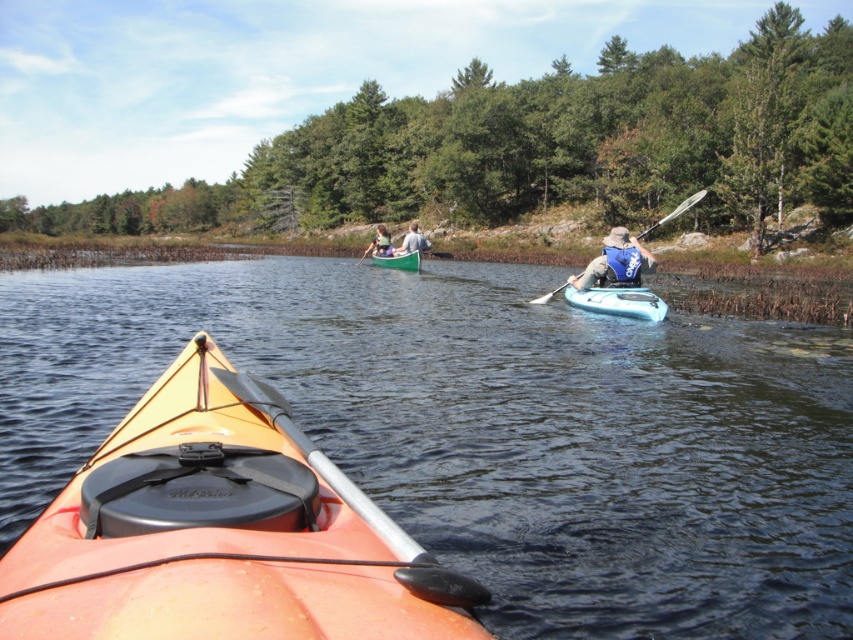
Is point (596, 285) in front of point (415, 221)?

Yes, point (596, 285) is closer to viewer.

Is point (659, 305) positioned after point (415, 244)?

No, it is not.

You are a GUI agent. You are given a task and a screenshot of the screen. Output one action in this format:
    pyautogui.click(x=<x>, y=<y>)
    Task: Click on the blue glossy kayak at center
    The width and height of the screenshot is (853, 640).
    Given the screenshot: What is the action you would take?
    pyautogui.click(x=618, y=301)

Which is more to the left, orange matte kayak at lower left or blue glossy kayak at center?

Positioned to the left is orange matte kayak at lower left.

Locate an element on the screen. This screenshot has height=640, width=853. orange matte kayak at lower left is located at coordinates (221, 532).

Can you confirm if blue glossy kayak at center is positioned below green wooden canoe at center?

Correct, blue glossy kayak at center is located below green wooden canoe at center.

Based on the photo, who is lower down, blue glossy kayak at center or green wooden canoe at center?

blue glossy kayak at center is below.

Does point (610, 285) come behind point (396, 262)?

No, it is in front of (396, 262).

I want to click on blue glossy kayak at center, so click(618, 301).